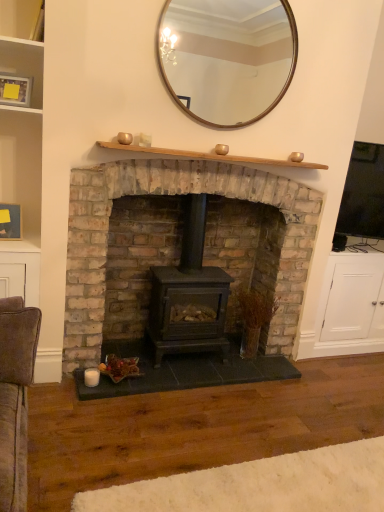
Question: Is wooden picture frame at left, arranged as the 2th picture frame when viewed from the top, at the right side of wooden-framed mirror at upper center?

Choices:
 (A) yes
 (B) no

Answer: (B)

Question: Can you confirm if wooden picture frame at left, arranged as the 2th picture frame when viewed from the top, is wider than wooden-framed mirror at upper center?

Choices:
 (A) yes
 (B) no

Answer: (A)

Question: Can you see wooden picture frame at left, the first picture frame viewed from the back, touching wooden-framed mirror at upper center?

Choices:
 (A) yes
 (B) no

Answer: (B)

Question: Does wooden picture frame at left, the 1th picture frame ordered from the bottom, have a greater height compared to wooden-framed mirror at upper center?

Choices:
 (A) yes
 (B) no

Answer: (B)

Question: Is wooden picture frame at left, the first picture frame viewed from the back, closer to camera compared to wooden-framed mirror at upper center?

Choices:
 (A) yes
 (B) no

Answer: (B)

Question: Considering the relative sizes of wooden picture frame at left, arranged as the 2th picture frame when viewed from the top, and wooden-framed mirror at upper center in the image provided, is wooden picture frame at left, arranged as the 2th picture frame when viewed from the top, shorter than wooden-framed mirror at upper center?

Choices:
 (A) yes
 (B) no

Answer: (A)

Question: Can you confirm if matte wooden picture frame at upper left, placed as the 2th picture frame when sorted from bottom to top, is shorter than wooden-framed mirror at upper center?

Choices:
 (A) no
 (B) yes

Answer: (B)

Question: From a real-world perspective, is matte wooden picture frame at upper left, arranged as the second picture frame when viewed from the back, on wooden-framed mirror at upper center?

Choices:
 (A) no
 (B) yes

Answer: (A)

Question: From the image's perspective, is matte wooden picture frame at upper left, which is counted as the first picture frame, starting from the front, above wooden-framed mirror at upper center?

Choices:
 (A) yes
 (B) no

Answer: (B)

Question: Is the depth of matte wooden picture frame at upper left, arranged as the second picture frame when viewed from the back, greater than that of wooden-framed mirror at upper center?

Choices:
 (A) yes
 (B) no

Answer: (A)

Question: Considering the relative sizes of matte wooden picture frame at upper left, placed as the 2th picture frame when sorted from bottom to top, and wooden-framed mirror at upper center in the image provided, is matte wooden picture frame at upper left, placed as the 2th picture frame when sorted from bottom to top, smaller than wooden-framed mirror at upper center?

Choices:
 (A) no
 (B) yes

Answer: (B)

Question: Can you confirm if matte wooden picture frame at upper left, which is the 1th picture frame in top-to-bottom order, is positioned to the right of wooden shelf at upper center?

Choices:
 (A) yes
 (B) no

Answer: (B)